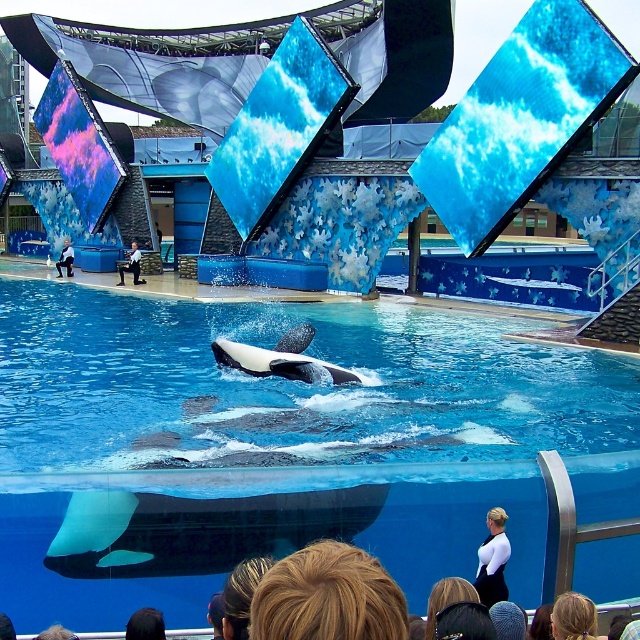
You are standing at the edge of the pool watching the orcas perform. There are two points marked in the image. Which point is closer to you, point (36, 460) or point (566, 593)?

Point (36, 460) is closer to you because it is further to the viewer than point (566, 593).

You are a visitor at the marine park and want to take a photo of the transparent glass pool at center without the blonde hair at lower right blocking the view. Is the pool visible above the hair?

The transparent glass pool at center is taller than blonde hair at lower right, so yes, the pool is visible above the blonde hair at lower right.